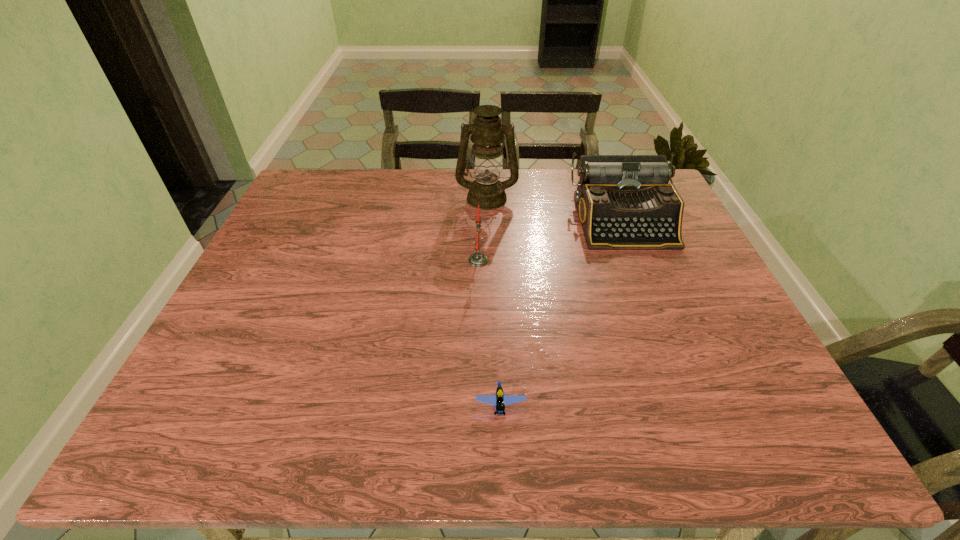
The image size is (960, 540). I want to click on free spot between the typewriter and the tallest object, so click(x=555, y=210).

Locate an element on the screen. vacant point located between the nearest object and the rightmost object is located at coordinates (563, 314).

At what (x,y) coordinates should I click in order to perform the action: click on free point between the tallest object and the second shortest object. Please return your answer as a coordinate pair (x, y). Looking at the image, I should click on (483, 229).

At what (x,y) coordinates should I click in order to perform the action: click on unoccupied area between the rightmost object and the tallest object. Please return your answer as a coordinate pair (x, y). Looking at the image, I should click on (555, 210).

At what (x,y) coordinates should I click in order to perform the action: click on free space between the typewriter and the shortest object. Please return your answer as a coordinate pair (x, y). The image size is (960, 540). Looking at the image, I should click on (563, 314).

Where is `vacant region between the nearest object and the candle`? The width and height of the screenshot is (960, 540). vacant region between the nearest object and the candle is located at coordinates (490, 334).

Where is `vacant area that lies between the oil lamp and the typewriter`? vacant area that lies between the oil lamp and the typewriter is located at coordinates (555, 210).

Identify which object is located as the nearest to the Lego. Please provide its 2D coordinates. Your answer should be formatted as a tuple, i.e. [(x, y)], where the tuple contains the x and y coordinates of a point satisfying the conditions above.

[(477, 259)]

Point out which object is positioned as the second nearest to the Lego. Please provide its 2D coordinates. Your answer should be formatted as a tuple, i.e. [(x, y)], where the tuple contains the x and y coordinates of a point satisfying the conditions above.

[(624, 202)]

Locate an element on the screen. Image resolution: width=960 pixels, height=540 pixels. free space that satisfies the following two spatial constraints: 1. on the keyboard of the typewriter; 2. on the front-facing side of the second shortest object is located at coordinates (639, 260).